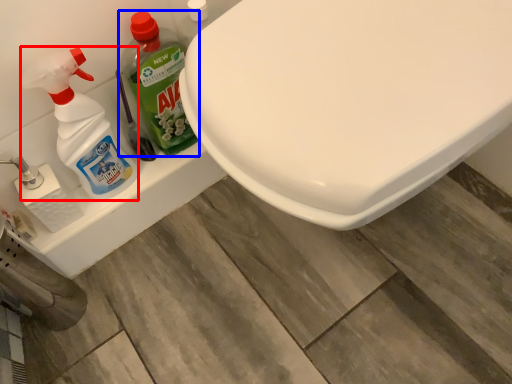
Question: Which of the following is the farthest to the observer, cleaning product (highlighted by a red box) or cleaning product (highlighted by a blue box)?

Choices:
 (A) cleaning product
 (B) cleaning product

Answer: (B)